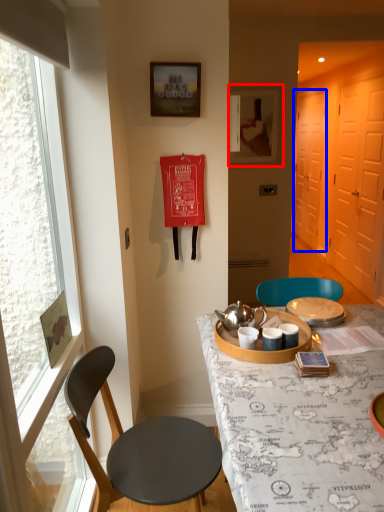
Question: Which of the following is the farthest to the observer, picture frame (highlighted by a red box) or screen door (highlighted by a blue box)?

Choices:
 (A) picture frame
 (B) screen door

Answer: (B)